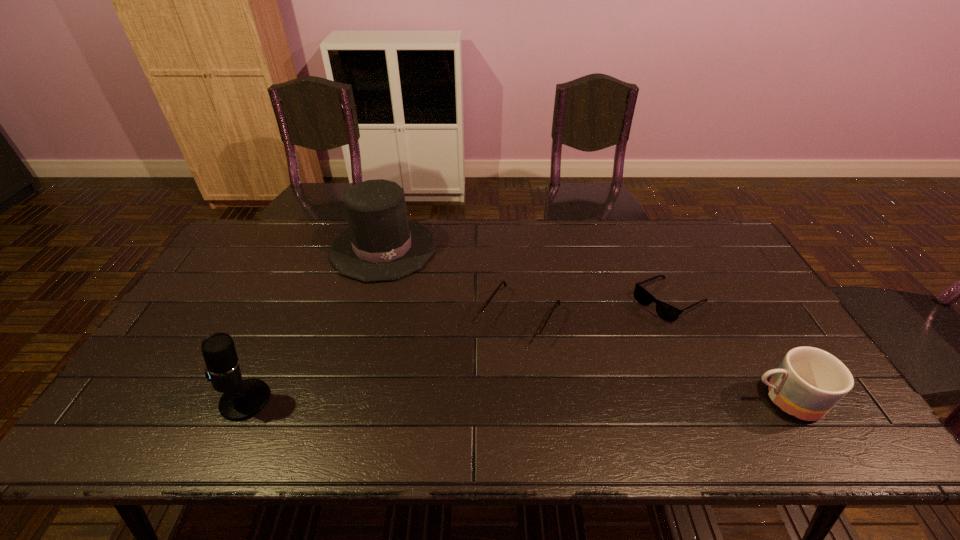
Select which object appears as the closest to the microphone. Please provide its 2D coordinates. Your answer should be formatted as a tuple, i.e. [(x, y)], where the tuple contains the x and y coordinates of a point satisfying the conditions above.

[(381, 244)]

Find the location of a particular element. The width and height of the screenshot is (960, 540). blank area in the image that satisfies the following two spatial constraints: 1. on the front side of the third tallest object; 2. on the side with the handle of the sunglasses is located at coordinates (713, 400).

Where is `vacant area that satisfies the following two spatial constraints: 1. on the front side of the fourth object from right to left; 2. on the side with the handle of the third shortest object`? The image size is (960, 540). vacant area that satisfies the following two spatial constraints: 1. on the front side of the fourth object from right to left; 2. on the side with the handle of the third shortest object is located at coordinates (344, 400).

Where is `vacant space that satisfies the following two spatial constraints: 1. on the back side of the leftmost object; 2. on the side with the handle of the third tallest object`? The height and width of the screenshot is (540, 960). vacant space that satisfies the following two spatial constraints: 1. on the back side of the leftmost object; 2. on the side with the handle of the third tallest object is located at coordinates (246, 400).

Find the location of a particular element. vacant point that satisfies the following two spatial constraints: 1. on the back side of the microphone; 2. on the side with the handle of the mug is located at coordinates (246, 400).

Find the location of a particular element. The width and height of the screenshot is (960, 540). free point that satisfies the following two spatial constraints: 1. on the back side of the third tallest object; 2. on the side with the handle of the leftmost object is located at coordinates [x=246, y=400].

Where is `vacant space that satisfies the following two spatial constraints: 1. on the front side of the third object from left to right; 2. on the side with the handle of the third tallest object`? The image size is (960, 540). vacant space that satisfies the following two spatial constraints: 1. on the front side of the third object from left to right; 2. on the side with the handle of the third tallest object is located at coordinates (528, 400).

Find the location of a particular element. free space that satisfies the following two spatial constraints: 1. on the front side of the third tallest object; 2. on the side with the handle of the dress hat is located at coordinates (344, 400).